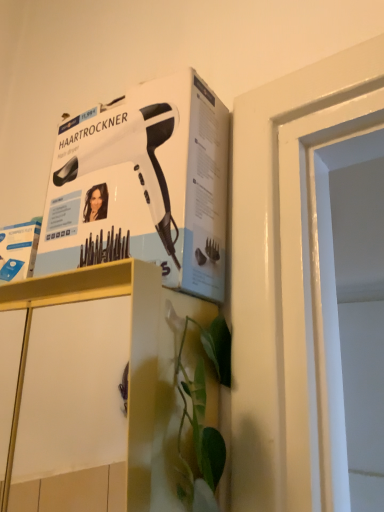
Question: From the image's perspective, is matte gold cabinet at lower center positioned above or below white matte hair dryer at upper left?

Choices:
 (A) below
 (B) above

Answer: (A)

Question: From a real-world perspective, is matte gold cabinet at lower center above or below white matte hair dryer at upper left?

Choices:
 (A) above
 (B) below

Answer: (B)

Question: Is matte gold cabinet at lower center wider or thinner than white matte hair dryer at upper left?

Choices:
 (A) wide
 (B) thin

Answer: (A)

Question: Choose the correct answer: Is white matte hair dryer at upper left inside matte gold cabinet at lower center or outside it?

Choices:
 (A) inside
 (B) outside

Answer: (B)

Question: From a real-world perspective, is white matte hair dryer at upper left positioned above or below matte gold cabinet at lower center?

Choices:
 (A) below
 (B) above

Answer: (B)

Question: Is point (180, 115) positioned closer to the camera than point (139, 398)?

Choices:
 (A) closer
 (B) farther

Answer: (B)

Question: Looking at the image, does white matte hair dryer at upper left seem bigger or smaller compared to matte gold cabinet at lower center?

Choices:
 (A) small
 (B) big

Answer: (A)